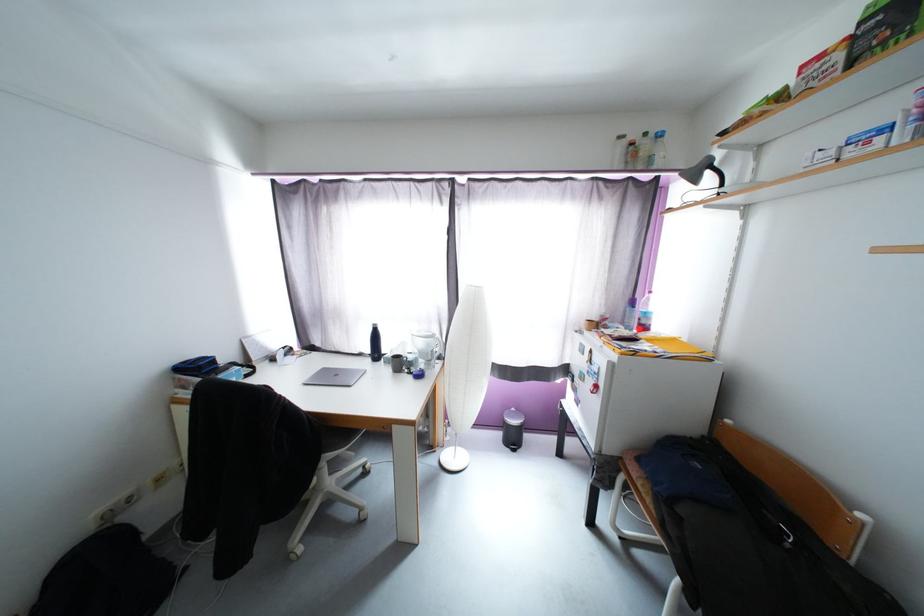
Identify the location of grey lamp head. (466, 371).